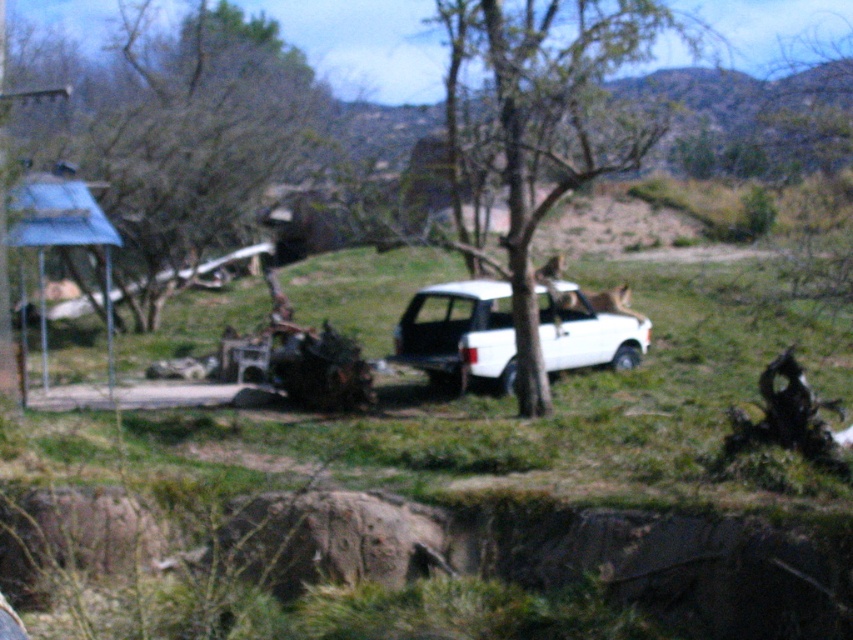
Is brown bark tree at center further to camera compared to white matte suv at center?

No, brown bark tree at center is in front of white matte suv at center.

Can you confirm if brown bark tree at center is positioned above white matte suv at center?

Yes, brown bark tree at center is above white matte suv at center.

Is point (648, 49) positioned after point (468, 356)?

No.

At what (x,y) coordinates should I click in order to perform the action: click on brown bark tree at center. Please return your answer as a coordinate pair (x, y). Image resolution: width=853 pixels, height=640 pixels. Looking at the image, I should click on (561, 128).